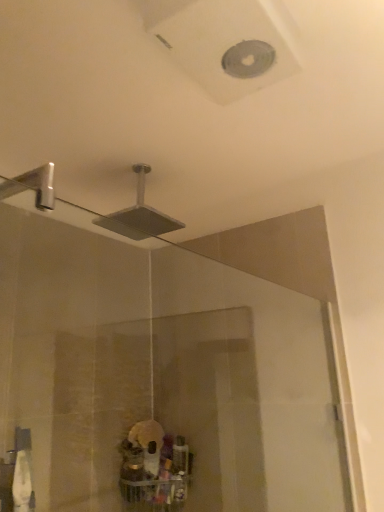
Question: Can you confirm if metallic silver showerhead at upper center is shorter than transparent glass door at center?

Choices:
 (A) yes
 (B) no

Answer: (A)

Question: Is transparent glass door at center a part of metallic silver showerhead at upper center?

Choices:
 (A) no
 (B) yes

Answer: (A)

Question: Is metallic silver showerhead at upper center smaller than transparent glass door at center?

Choices:
 (A) yes
 (B) no

Answer: (A)

Question: Can you confirm if metallic silver showerhead at upper center is thinner than transparent glass door at center?

Choices:
 (A) no
 (B) yes

Answer: (B)

Question: From the image's perspective, is metallic silver showerhead at upper center above transparent glass door at center?

Choices:
 (A) no
 (B) yes

Answer: (B)

Question: Is metallic silver showerhead at upper center completely or partially outside of transparent glass door at center?

Choices:
 (A) yes
 (B) no

Answer: (A)

Question: From the image's perspective, does transparent glass door at center appear lower than metallic silver showerhead at upper center?

Choices:
 (A) yes
 (B) no

Answer: (A)

Question: Is metallic silver showerhead at upper center located within transparent glass door at center?

Choices:
 (A) yes
 (B) no

Answer: (B)

Question: Is transparent glass door at center outside metallic silver showerhead at upper center?

Choices:
 (A) yes
 (B) no

Answer: (A)

Question: Considering the relative sizes of transparent glass door at center and metallic silver showerhead at upper center in the image provided, is transparent glass door at center wider than metallic silver showerhead at upper center?

Choices:
 (A) yes
 (B) no

Answer: (A)

Question: Is transparent glass door at center facing towards metallic silver showerhead at upper center?

Choices:
 (A) no
 (B) yes

Answer: (A)

Question: Does transparent glass door at center lie in front of metallic silver showerhead at upper center?

Choices:
 (A) yes
 (B) no

Answer: (A)

Question: Considering the relative positions of metallic silver showerhead at upper center and transparent glass door at center in the image provided, is metallic silver showerhead at upper center to the left or to the right of transparent glass door at center?

Choices:
 (A) left
 (B) right

Answer: (A)